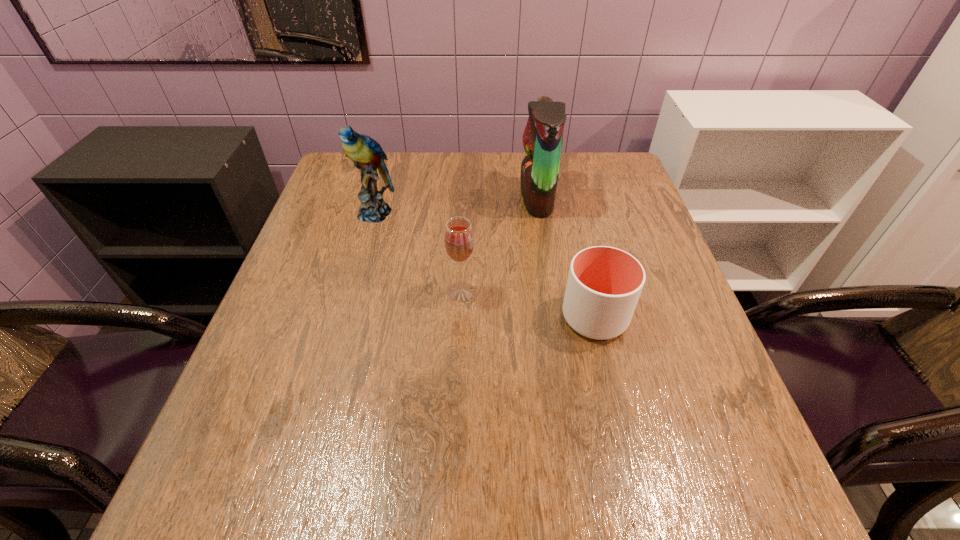
At what (x,y) coordinates should I click in order to perform the action: click on blank space located on the back of the cup. Please return your answer as a coordinate pair (x, y). Image resolution: width=960 pixels, height=540 pixels. Looking at the image, I should click on (584, 271).

Identify the location of object that is at the far edge. 543,136.

Find the location of a particular element. object that is at the left edge is located at coordinates (367, 155).

Locate an element on the screen. Image resolution: width=960 pixels, height=540 pixels. object that is at the right edge is located at coordinates (604, 284).

I want to click on vacant space at the near edge of the desktop, so click(309, 516).

At what (x,y) coordinates should I click in order to perform the action: click on vacant region at the left edge of the desktop. Please return your answer as a coordinate pair (x, y). The width and height of the screenshot is (960, 540). Looking at the image, I should click on (329, 218).

Locate an element on the screen. The height and width of the screenshot is (540, 960). vacant region at the right edge of the desktop is located at coordinates (679, 318).

In the image, there is a desktop. At what (x,y) coordinates should I click in order to perform the action: click on vacant space at the far left corner. Please return your answer as a coordinate pair (x, y). This screenshot has width=960, height=540. Looking at the image, I should click on (359, 180).

Where is `vacant area at the near left corner`? The width and height of the screenshot is (960, 540). vacant area at the near left corner is located at coordinates (202, 474).

What are the coordinates of `blank space at the far right corner of the desktop` in the screenshot? It's located at (626, 167).